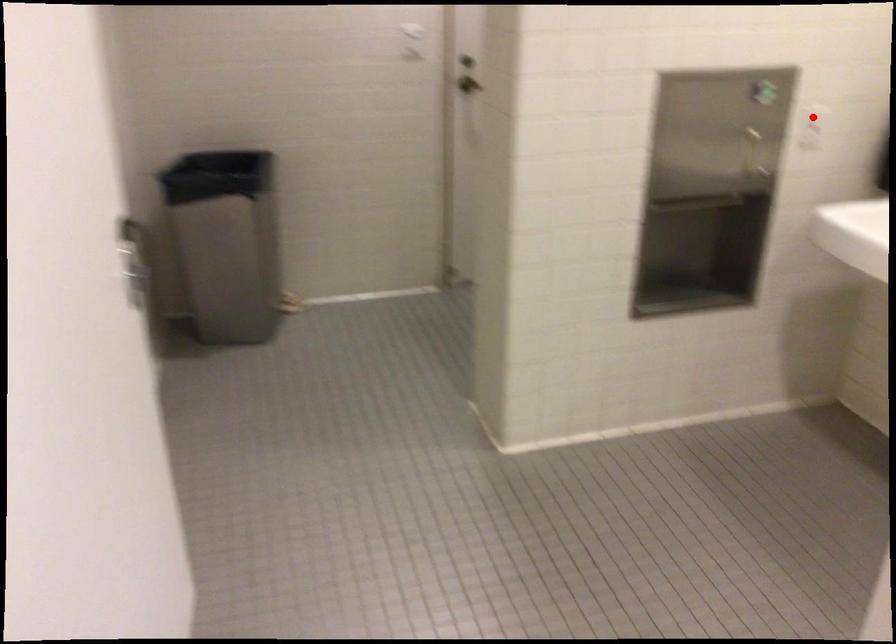
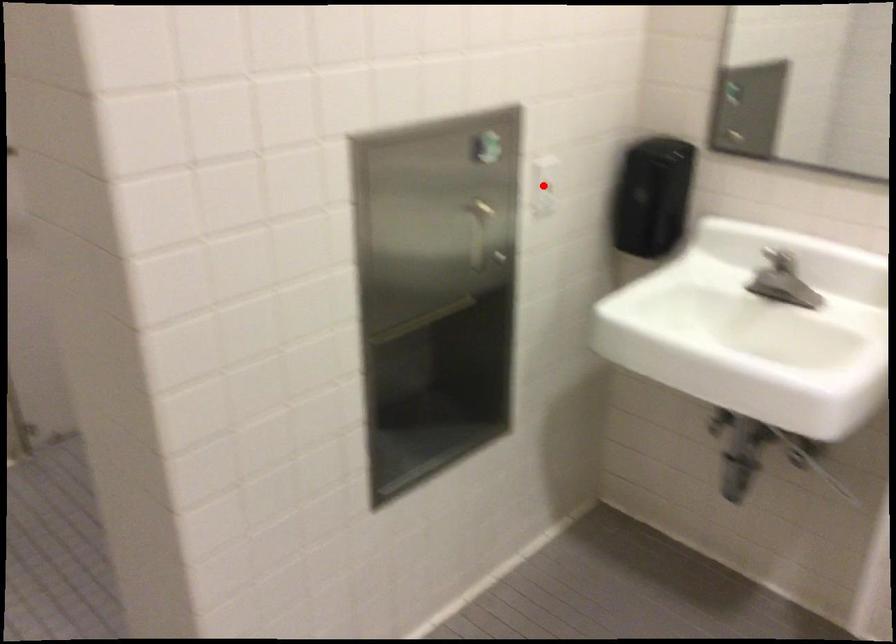
I am providing you with two images of the same scene from different viewpoints. A red point is marked on the first image and another point is marked on the second image. Is the marked point in image1 the same physical position as the marked point in image2?

Yes